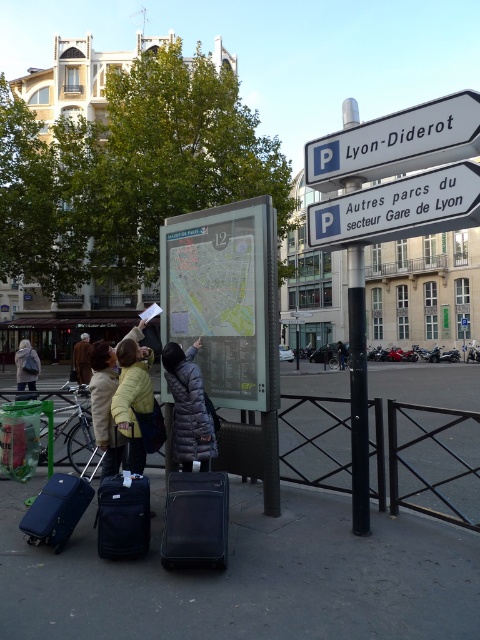
Is matte blue suitcase at lower left positioned at the back of light brown leather jacket at center?

No, matte blue suitcase at lower left is in front of light brown leather jacket at center.

This screenshot has height=640, width=480. Describe the element at coordinates (57, 509) in the screenshot. I see `matte blue suitcase at lower left` at that location.

Describe the element at coordinates (57, 509) in the screenshot. I see `matte blue suitcase at lower left` at that location.

The image size is (480, 640). In order to click on matte blue suitcase at lower left in this screenshot , I will do `click(57, 509)`.

Does light gray down jacket at center have a lesser width compared to dark gray jacket at center?

Yes, light gray down jacket at center is thinner than dark gray jacket at center.

Which is behind, point (213, 444) or point (344, 349)?

The point (344, 349) is more distant.

Does point (202, 461) lie in front of point (338, 365)?

Yes.

You are a GUI agent. You are given a task and a screenshot of the screen. Output one action in this format:
    pyautogui.click(x=<x>, y=<y>)
    Task: Click on the light gray down jacket at center
    The width and height of the screenshot is (480, 640).
    Given the screenshot: What is the action you would take?
    pyautogui.click(x=190, y=406)

Can you confirm if dark blue fabric suitcase at lower left is taller than light gray jacket at center?

No, dark blue fabric suitcase at lower left is not taller than light gray jacket at center.

Which is in front, point (122, 476) or point (35, 390)?

Point (122, 476) is more forward.

Who is more forward, (132, 461) or (25, 380)?

Point (132, 461) is more forward.

Find the location of a particular element. This screenshot has height=640, width=480. dark blue fabric suitcase at lower left is located at coordinates (123, 513).